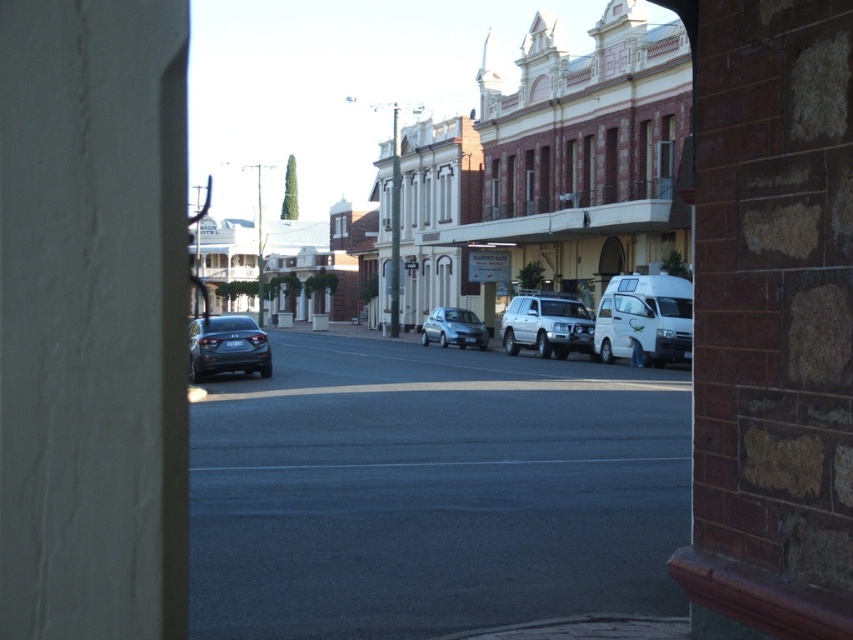
You are a delivery driver who needs to park your truck, which is 2 meters wide, in this street. There is a satin black car at center and a matte white building at center. Can you park your truck between them without overlapping either?

The satin black car at center is narrower than the matte white building at center. However, the exact distance between them isn not specified. Without knowing the space between the car and the building, it is impossible to determine if the truck will fit.

From the picture: You are a delivery driver who needs to park your vehicle between the two buildings. You see the white matte van at center and the satin silver car at center. Which vehicle should you avoid parking behind to ensure your license plate is visible?

You should avoid parking behind the white matte van at center because it is positioned over the satin silver car at center, which means it is closer to you. Parking behind the white matte van at center would block the view of the satin silver car at center.